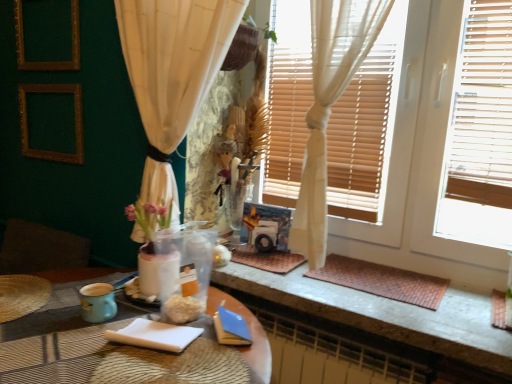
Question: Considering the positions of white wood window frame at upper right and white paper notepad at lower center in the image, is white wood window frame at upper right taller or shorter than white paper notepad at lower center?

Choices:
 (A) tall
 (B) short

Answer: (A)

Question: Is white wood window frame at upper right wider or thinner than white paper notepad at lower center?

Choices:
 (A) thin
 (B) wide

Answer: (A)

Question: Which is farther from the brown woven mat at lower right?

Choices:
 (A) white wood window frame at upper right
 (B) matte plastic table at center
 (C) gold textured picture frame at upper left, the 1th picture frame when ordered from bottom to top
 (D) gold wooden picture frame at upper left, the second picture frame in the bottom-to-top sequence
 (E) white paper notepad at lower center

Answer: (D)

Question: Which object is positioned farthest from the teal ceramic mug at lower left?

Choices:
 (A) gold wooden picture frame at upper left, which is the 1th picture frame from top to bottom
 (B) matte plastic table at center
 (C) white wood window frame at upper right
 (D) gold textured picture frame at upper left, the 1th picture frame when ordered from bottom to top
 (E) white paper notepad at lower center

Answer: (A)